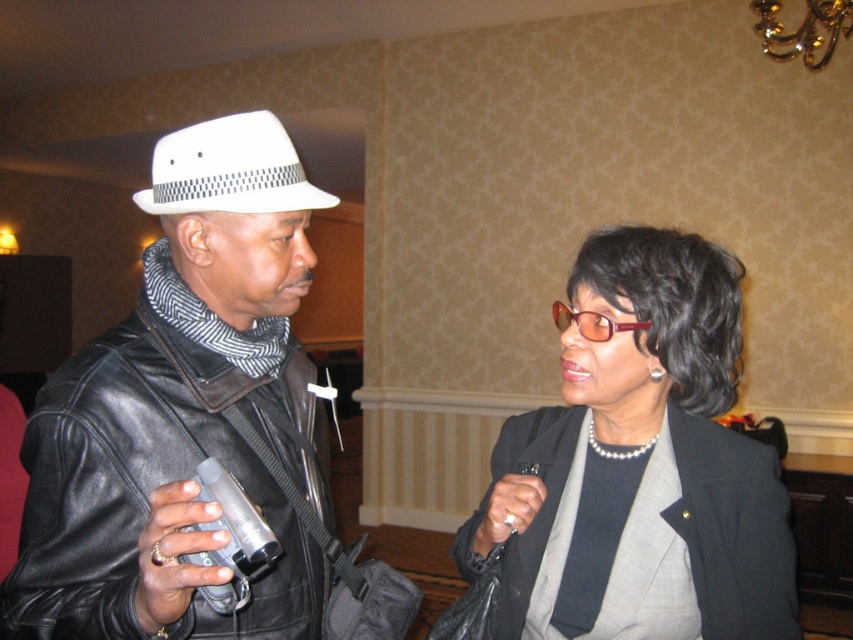
Question: Is matte black leather jacket at left positioned at the back of pearl necklace at center?

Choices:
 (A) no
 (B) yes

Answer: (A)

Question: Which of the following is the closest to the observer?

Choices:
 (A) matte black leather jacket at left
 (B) white felt fedora at left
 (C) pearl necklace at center

Answer: (A)

Question: Is matte black leather jacket at left to the right of white felt fedora at left from the viewer's perspective?

Choices:
 (A) no
 (B) yes

Answer: (B)

Question: Which object appears farthest from the camera in this image?

Choices:
 (A) white felt fedora at left
 (B) matte black leather jacket at left
 (C) pearl necklace at center

Answer: (C)

Question: Does matte black leather jacket at left have a larger size compared to pearl necklace at center?

Choices:
 (A) no
 (B) yes

Answer: (A)

Question: Which point appears closest to the camera in this image?

Choices:
 (A) (281, 211)
 (B) (660, 362)
 (C) (294, 637)

Answer: (A)